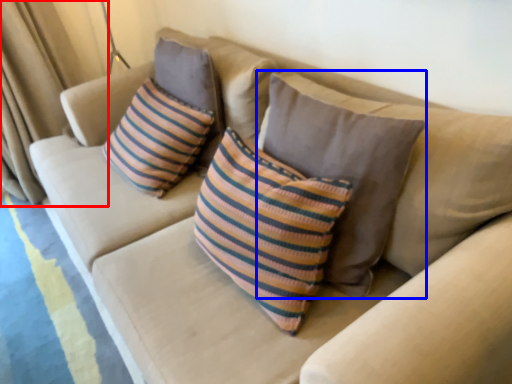
Question: Which of the following is the closest to the observer, curtain (highlighted by a red box) or pillow (highlighted by a blue box)?

Choices:
 (A) curtain
 (B) pillow

Answer: (B)